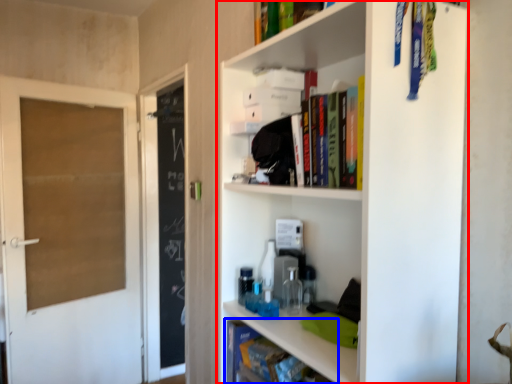
Question: Among these objects, which one is nearest to the camera, shelf (highlighted by a red box) or book (highlighted by a blue box)?

Choices:
 (A) shelf
 (B) book

Answer: (A)